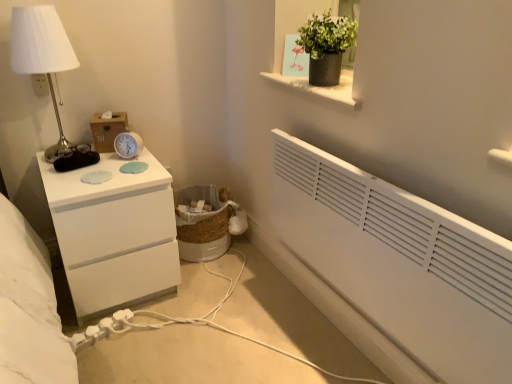
Find the location of a particular element. vacant region to the right of white glossy chest of drawers at left is located at coordinates (219, 301).